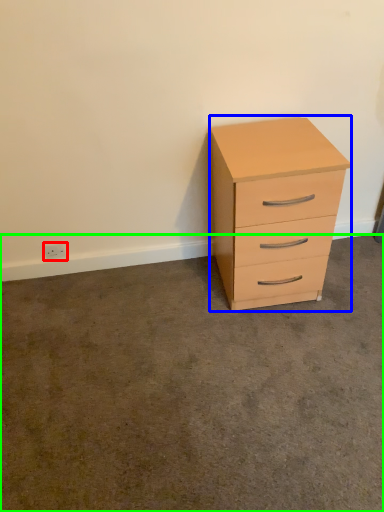
Question: Which object is positioned farthest from electric outlet (highlighted by a red box)? Select from chest of drawers (highlighted by a blue box) and concrete (highlighted by a green box).

Choices:
 (A) chest of drawers
 (B) concrete

Answer: (A)